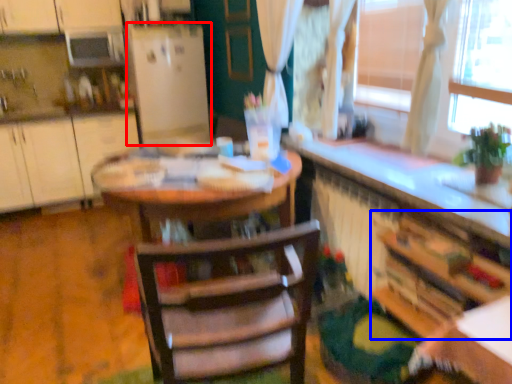
Question: Which object is further to the camera taking this photo, fridge (highlighted by a red box) or cabinetry (highlighted by a blue box)?

Choices:
 (A) fridge
 (B) cabinetry

Answer: (A)